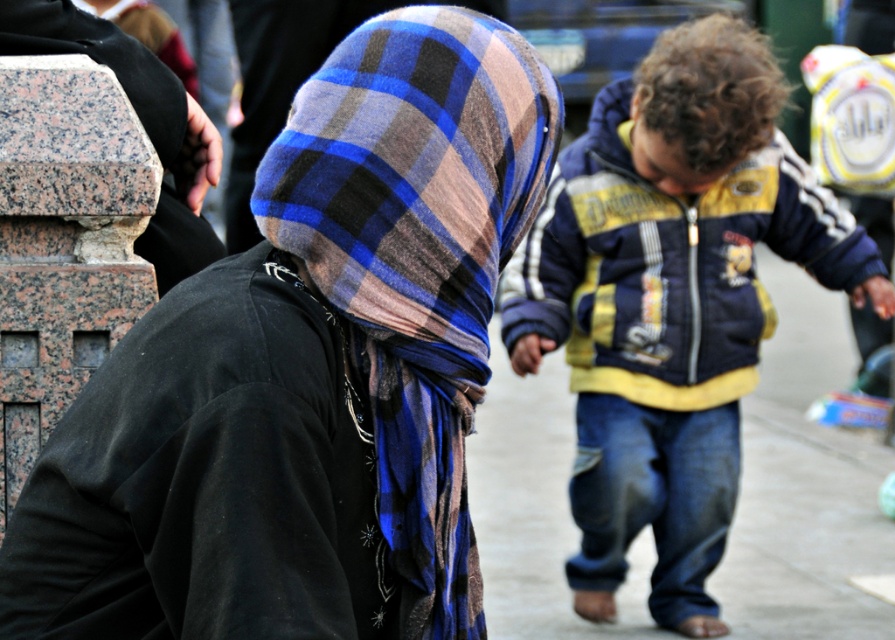
Question: Which point is closer to the camera taking this photo?

Choices:
 (A) (584, 342)
 (B) (474, 621)

Answer: (B)

Question: Which point is closer to the camera taking this photo?

Choices:
 (A) (546, 134)
 (B) (700, 534)

Answer: (A)

Question: Which point is closer to the camera?

Choices:
 (A) blue and yellow jacket at center
 (B) plaid wool scarf at center

Answer: (B)

Question: Can you confirm if blue and yellow jacket at center is positioned above plaid wool scarf at center?

Choices:
 (A) yes
 (B) no

Answer: (A)

Question: From the image, what is the correct spatial relationship of blue and yellow jacket at center in relation to plaid wool scarf at center?

Choices:
 (A) below
 (B) above

Answer: (B)

Question: Does blue and yellow jacket at center have a larger size compared to plaid wool scarf at center?

Choices:
 (A) no
 (B) yes

Answer: (B)